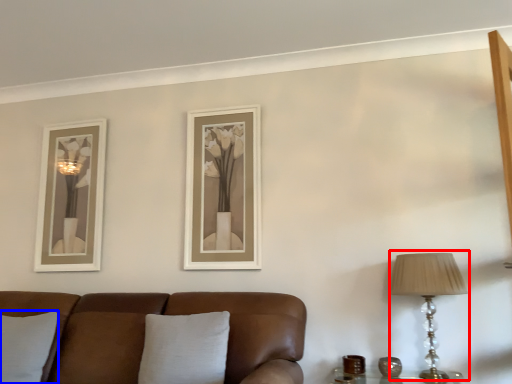
Question: Among these objects, which one is nearest to the camera, table lamp (highlighted by a red box) or pillow (highlighted by a blue box)?

Choices:
 (A) table lamp
 (B) pillow

Answer: (A)